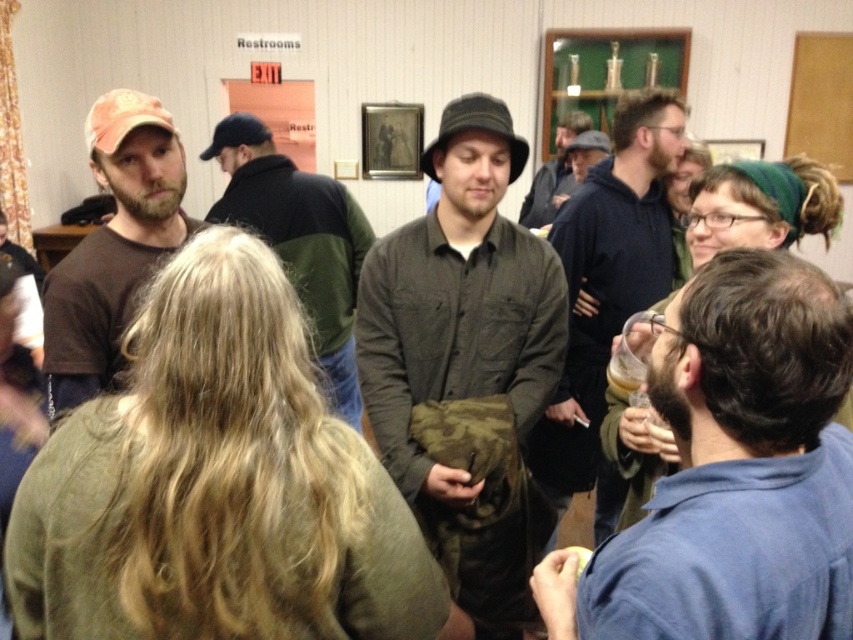
Can you confirm if dark green canvas jacket at center is thinner than dark gray cotton shirt at center?

Indeed, dark green canvas jacket at center has a lesser width compared to dark gray cotton shirt at center.

Is dark green canvas jacket at center positioned in front of dark gray cotton shirt at center?

That is True.

The width and height of the screenshot is (853, 640). What are the coordinates of `dark green canvas jacket at center` in the screenshot? It's located at (459, 300).

Find the location of `dark green canvas jacket at center`. dark green canvas jacket at center is located at coordinates (459, 300).

From the picture: Between dark gray cotton shirt at center and dark gray shirt at center, which one is positioned lower?

dark gray cotton shirt at center is lower down.

Which is behind, point (218, 129) or point (537, 188)?

Positioned behind is point (537, 188).

Is point (325, 260) closer to viewer compared to point (585, 116)?

That is True.

You are a GUI agent. You are given a task and a screenshot of the screen. Output one action in this format:
    pyautogui.click(x=<x>, y=<y>)
    Task: Click on the dark gray cotton shirt at center
    The width and height of the screenshot is (853, 640).
    Given the screenshot: What is the action you would take?
    pyautogui.click(x=299, y=241)

Is blonde hair at center below matte brown shirt at left?

Yes.

Which is above, blonde hair at center or matte brown shirt at left?

matte brown shirt at left is higher up.

Does point (202, 356) come in front of point (97, 177)?

Yes, point (202, 356) is in front of point (97, 177).

The height and width of the screenshot is (640, 853). What are the coordinates of `blonde hair at center` in the screenshot? It's located at (216, 484).